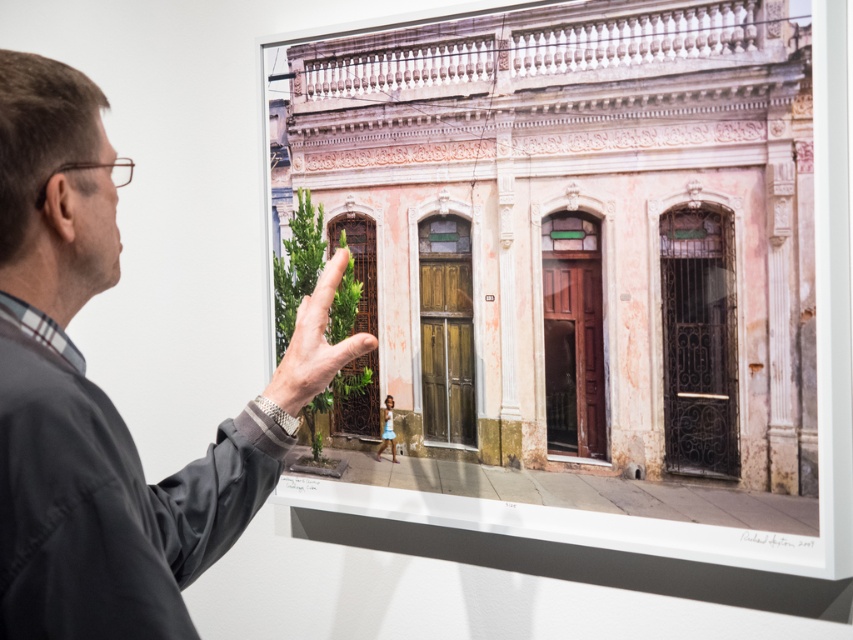
Is point (752, 461) behind point (56, 177)?

Yes, point (752, 461) is behind point (56, 177).

Does matte pink building at center appear under gray fabric shirt at upper left?

Actually, matte pink building at center is above gray fabric shirt at upper left.

Where is `matte pink building at center`? The height and width of the screenshot is (640, 853). matte pink building at center is located at coordinates (575, 230).